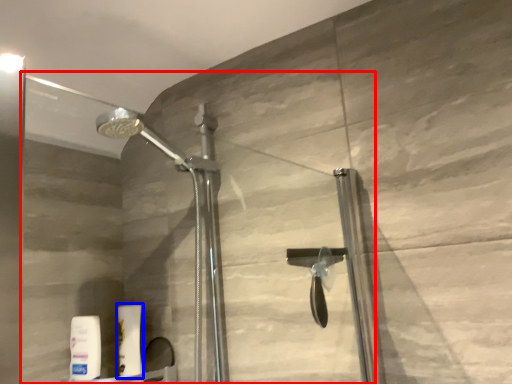
Question: Which of the following is the closest to the observer, glass door (highlighted by a red box) or toiletry (highlighted by a blue box)?

Choices:
 (A) glass door
 (B) toiletry

Answer: (A)